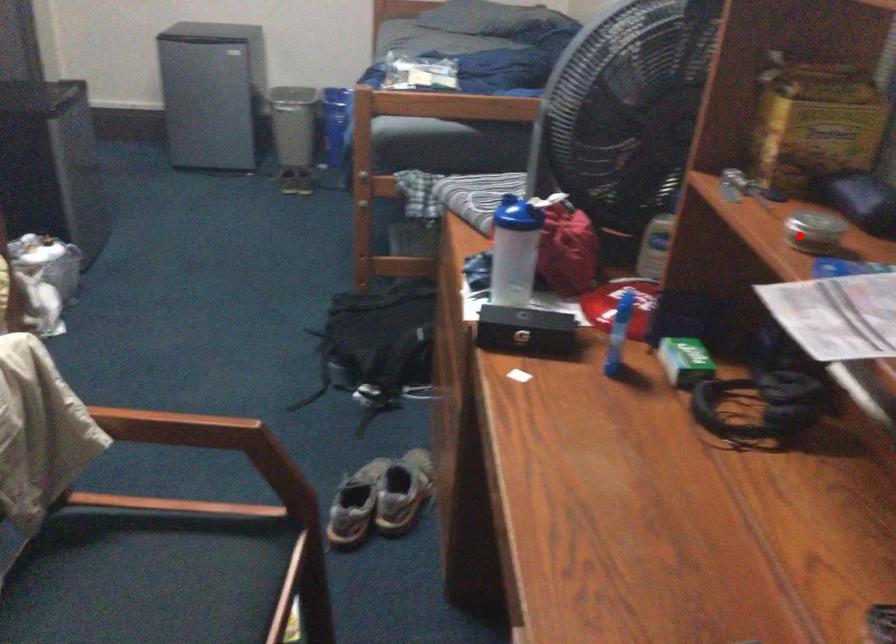
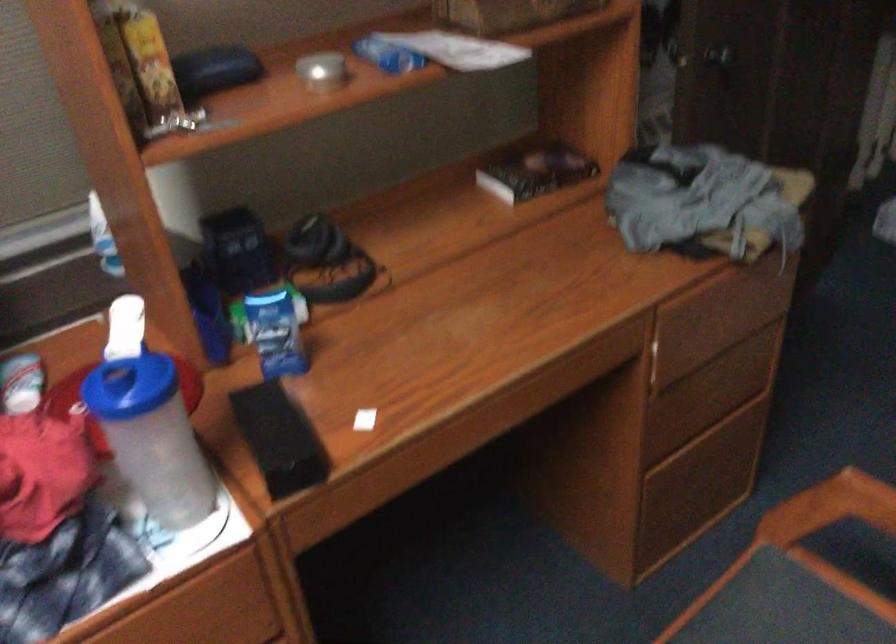
Where in the second image is the point corresponding to the highlighted location from the first image?

(322, 71)